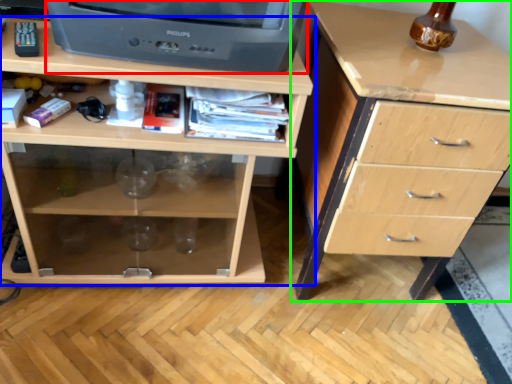
Question: Which object is the farthest from television (highlighted by a red box)? Choose among these: chest of drawers (highlighted by a blue box) or chest of drawers (highlighted by a green box).

Choices:
 (A) chest of drawers
 (B) chest of drawers

Answer: (B)